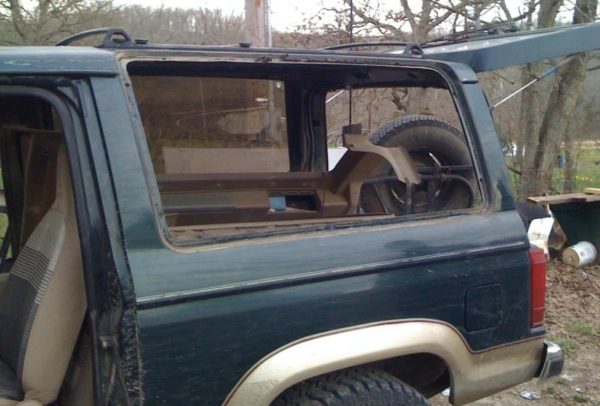
This screenshot has width=600, height=406. What are the coordinates of `bucket` in the screenshot? It's located at (581, 257).